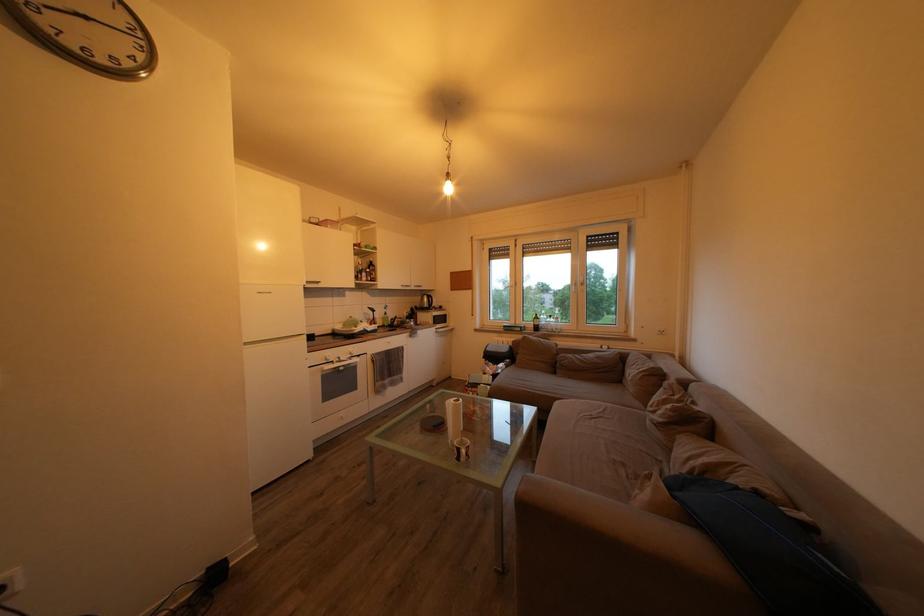
At what (x,y) coordinates should I click in order to perform the action: click on green wine bottle. Please return your answer as a coordinate pair (x, y). The width and height of the screenshot is (924, 616). Looking at the image, I should click on (536, 322).